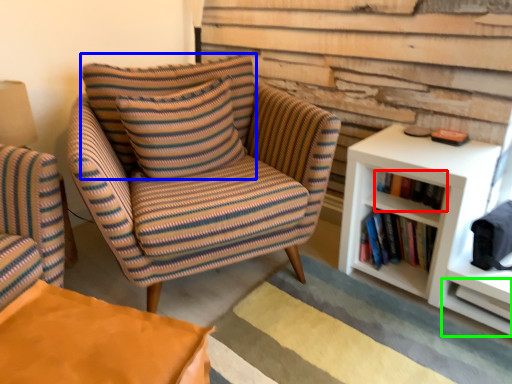
Question: Based on their relative distances, which object is farther from book (highlighted by a red box)? Choose from pillow (highlighted by a blue box) and shelf (highlighted by a green box).

Choices:
 (A) pillow
 (B) shelf

Answer: (A)